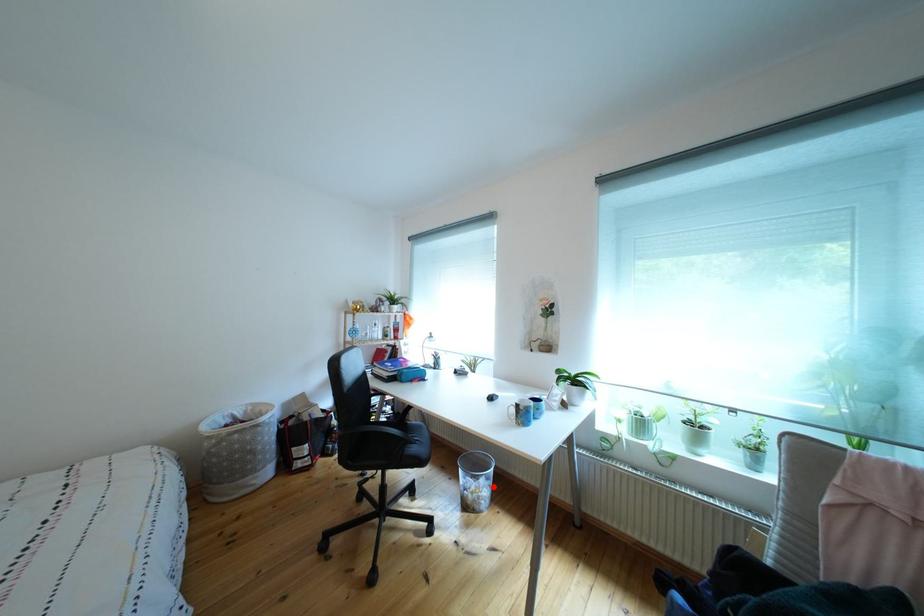
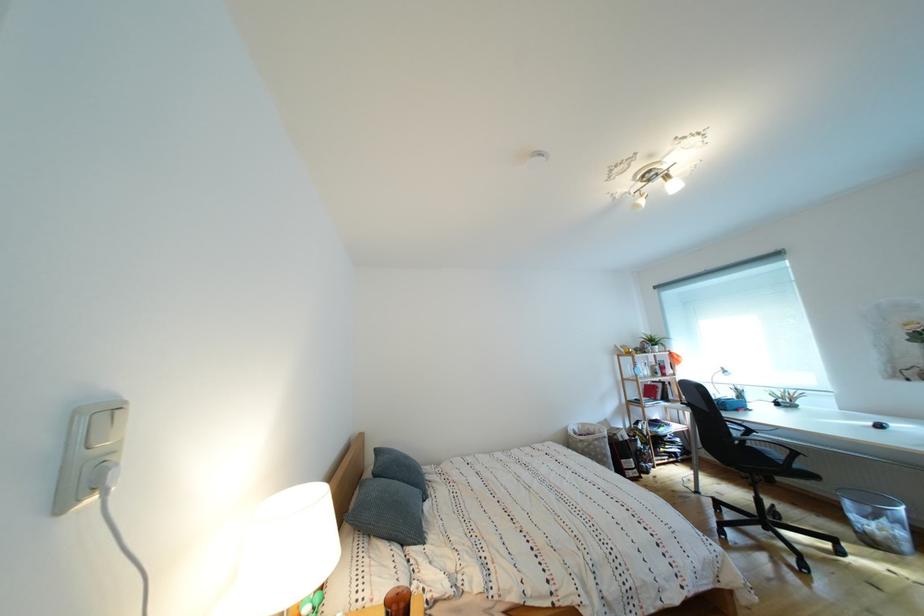
Locate, in the second image, the point that corresponds to the highlighted location in the first image.

(896, 527)